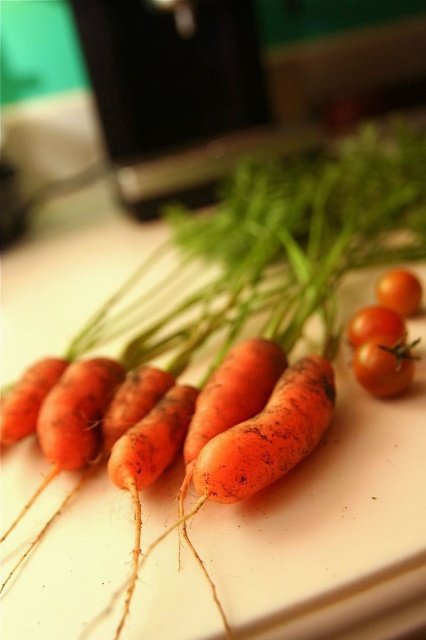
Question: Which object is farther from the camera taking this photo?

Choices:
 (A) glossy orange tomato at center right
 (B) orange rough carrot at center
 (C) glossy red tomato at lower right

Answer: (A)

Question: Does orange matte carrot at center have a greater width compared to glossy orange tomato at center right?

Choices:
 (A) no
 (B) yes

Answer: (B)

Question: Can you confirm if orange rough carrot at center is bigger than glossy cherry tomato at center?

Choices:
 (A) no
 (B) yes

Answer: (B)

Question: Which of the following is the closest to the observer?

Choices:
 (A) orange rough carrot at center
 (B) glossy cherry tomato at center
 (C) glossy orange tomato at center right

Answer: (A)

Question: Estimate the real-world distances between objects in this image. Which object is closer to the glossy red tomato at lower right?

Choices:
 (A) glossy cherry tomato at center
 (B) orange matte carrot at center
 (C) glossy orange tomato at center right
 (D) orange rough carrot at center

Answer: (A)

Question: Is orange matte carrot at center smaller than glossy orange tomato at center right?

Choices:
 (A) yes
 (B) no

Answer: (B)